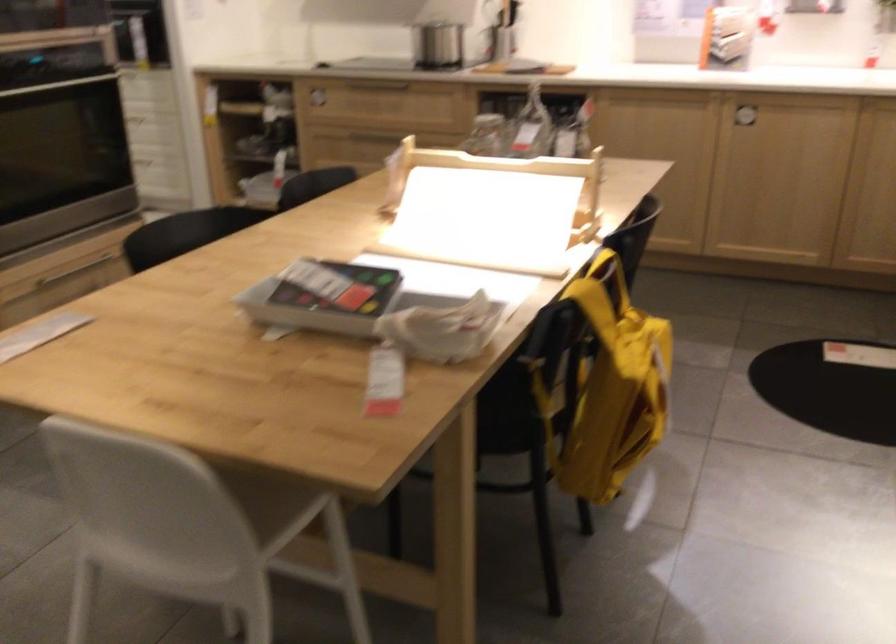
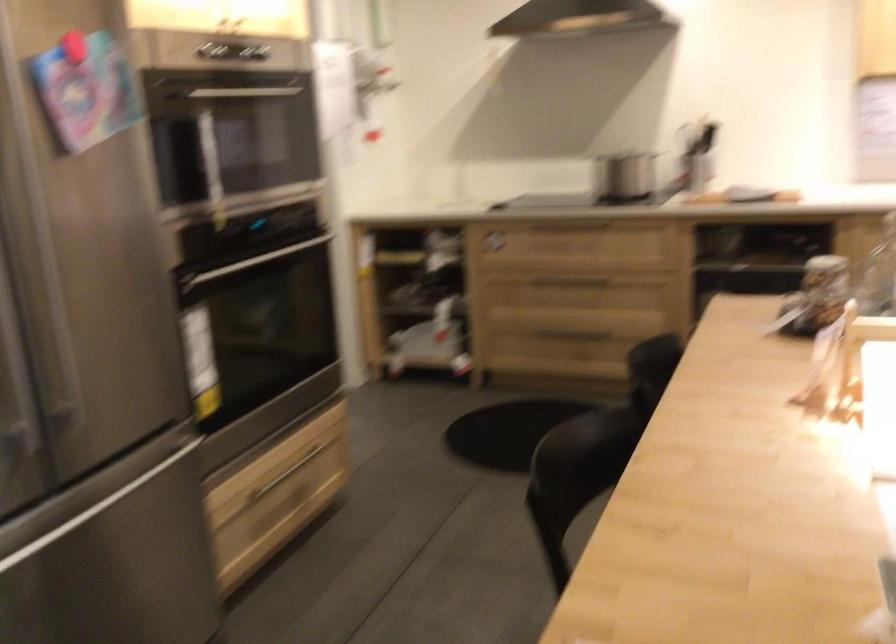
Based on the photo, in a continuous first-person perspective shot, in which direction is the camera moving?

The cameraman moved toward left, forward.